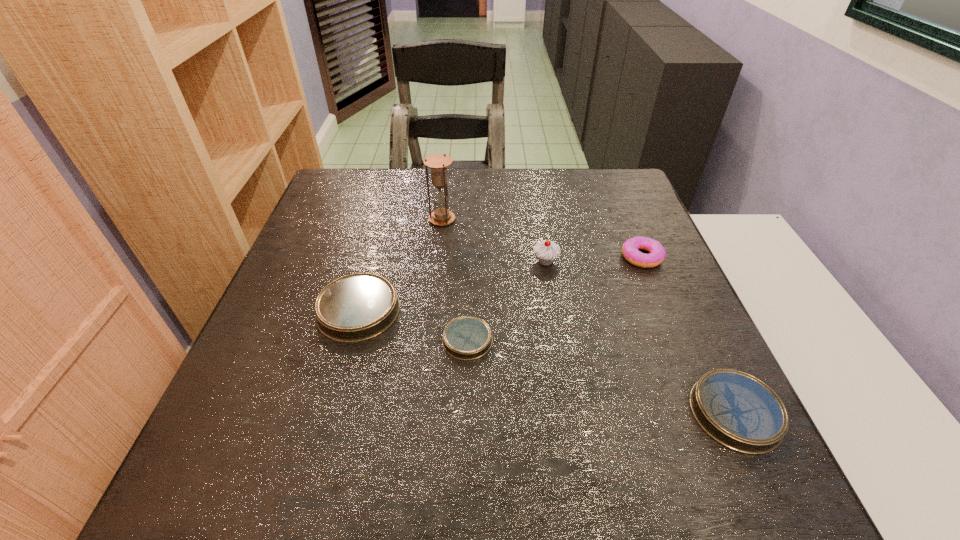
The width and height of the screenshot is (960, 540). Find the location of `vacant space situated on the right of the leftmost object`. vacant space situated on the right of the leftmost object is located at coordinates (551, 310).

The width and height of the screenshot is (960, 540). Identify the location of vacant space located on the right of the shortest compass. (663, 340).

The width and height of the screenshot is (960, 540). I want to click on vacant space situated on the back of the rightmost compass, so click(x=679, y=292).

The image size is (960, 540). I want to click on free point located on the right of the farthest object, so click(545, 219).

Identify the location of vacant space located 0.240m on the left of the fourth object from left to right. The width and height of the screenshot is (960, 540). (431, 261).

The image size is (960, 540). In order to click on vacant region located on the back of the doughnut in this screenshot , I will do `click(612, 185)`.

You are a GUI agent. You are given a task and a screenshot of the screen. Output one action in this format:
    pyautogui.click(x=<x>, y=<y>)
    Task: Click on the object located at the far edge
    Image resolution: width=960 pixels, height=540 pixels.
    Given the screenshot: What is the action you would take?
    pyautogui.click(x=438, y=163)

You are a GUI agent. You are given a task and a screenshot of the screen. Output one action in this format:
    pyautogui.click(x=<x>, y=<y>)
    Task: Click on the object that is at the near edge
    
    Given the screenshot: What is the action you would take?
    pyautogui.click(x=737, y=410)

At what (x,y) coordinates should I click in order to perform the action: click on object positioned at the left edge. Please return your answer as a coordinate pair (x, y). Looking at the image, I should click on (357, 307).

You are a GUI agent. You are given a task and a screenshot of the screen. Output one action in this format:
    pyautogui.click(x=<x>, y=<y>)
    Task: Click on the compass positioned at the right edge
    This screenshot has width=960, height=540.
    Given the screenshot: What is the action you would take?
    pyautogui.click(x=737, y=410)